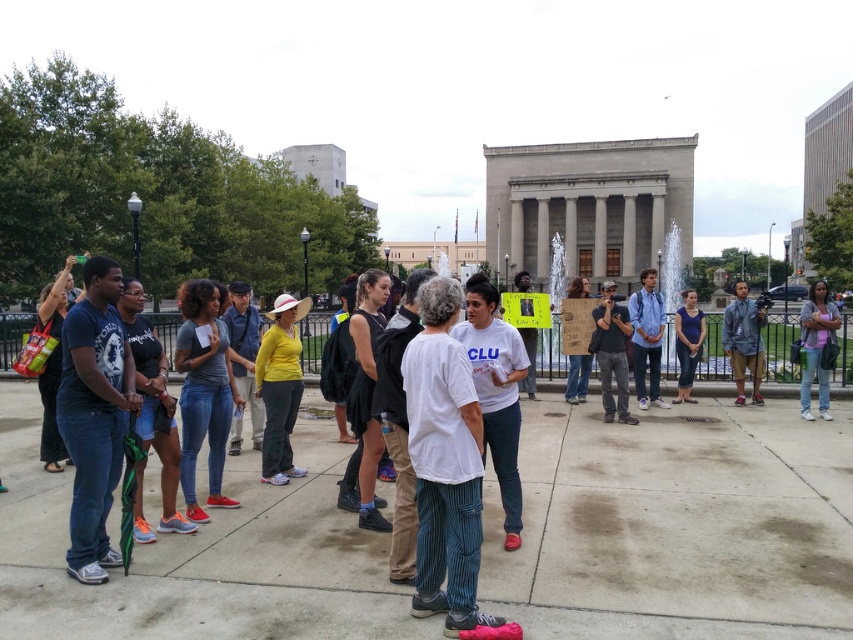
The width and height of the screenshot is (853, 640). What do you see at coordinates (646, 337) in the screenshot?
I see `blue denim jeans at center` at bounding box center [646, 337].

Which is behind, point (634, 308) or point (727, 320)?

The point (727, 320) is behind.

Identify the location of blue denim jeans at center. 646,337.

Who is positioned more to the right, matte yellow shirt at center or denim jeans at right?

Positioned to the right is denim jeans at right.

Describe the element at coordinates (280, 387) in the screenshot. I see `matte yellow shirt at center` at that location.

Between point (265, 400) and point (822, 346), which one is positioned in front?

Point (265, 400)

Locate an element on the screen. This screenshot has height=640, width=853. matte yellow shirt at center is located at coordinates [280, 387].

Is concrete pavement at center wider than denim jacket at right?

Yes.

Does concrete pavement at center appear under denim jacket at right?

Correct, concrete pavement at center is located below denim jacket at right.

Is point (77, 630) positioned in front of point (759, 317)?

That is True.

This screenshot has width=853, height=640. In order to click on concrete pavement at center in this screenshot , I will do `click(676, 524)`.